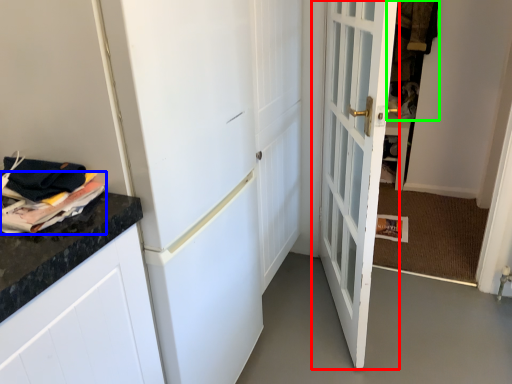
Question: Estimate the real-world distances between objects in this image. Which object is farther from door (highlighted by a red box), magazine (highlighted by a blue box) or laundry (highlighted by a green box)?

Choices:
 (A) magazine
 (B) laundry

Answer: (B)